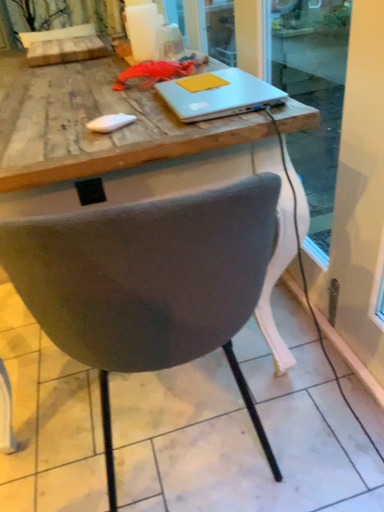
Identify the location of vacant area on top of sleek white laptop at center (from a real-world perspective). This screenshot has height=512, width=384. click(231, 80).